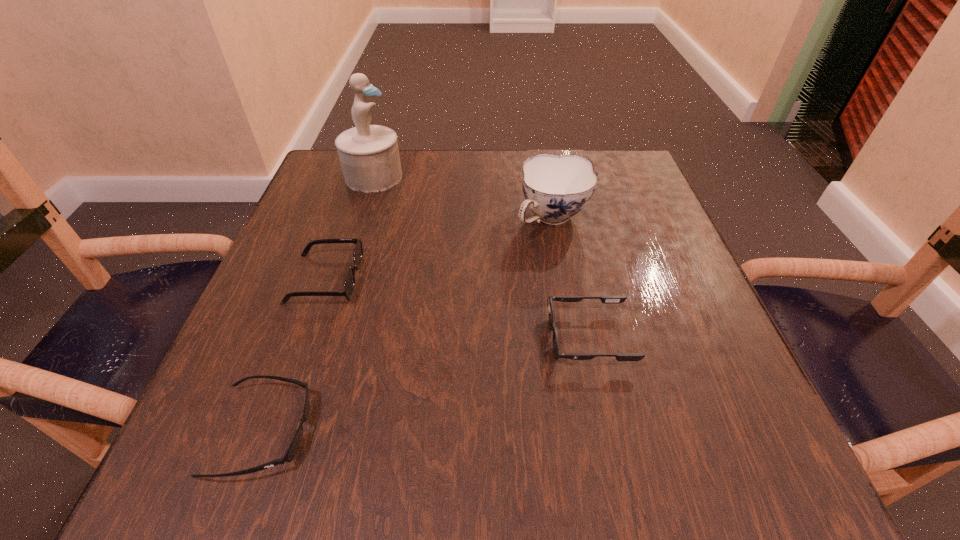
You are a GUI agent. You are given a task and a screenshot of the screen. Output one action in this format:
    pyautogui.click(x=<x>, y=<y>)
    Task: Click on the vacant area that lies between the fourth nearest object and the farthest object
    
    Given the screenshot: What is the action you would take?
    pyautogui.click(x=463, y=198)

Identify the location of free area in between the nearest object and the second nearest object. (426, 384).

Find the location of a particular element. object that is the second closest to the third nearest object is located at coordinates (369, 155).

What are the coordinates of `object identified as the third closest to the tallest object` in the screenshot? It's located at (604, 299).

Point out which sunglasses is positioned as the nearest to the chinaware. Please provide its 2D coordinates. Your answer should be formatted as a tuple, i.e. [(x, y)], where the tuple contains the x and y coordinates of a point satisfying the conditions above.

[(604, 299)]

Locate an element on the screen. The width and height of the screenshot is (960, 540). sunglasses that stands as the second closest to the nearest object is located at coordinates (604, 299).

What are the coordinates of `free space that satisfies the following two spatial constraints: 1. at the beak of the tallest object; 2. on the right side of the second farthest object` in the screenshot? It's located at (360, 219).

This screenshot has height=540, width=960. I want to click on vacant area that satisfies the following two spatial constraints: 1. at the beak of the tallest object; 2. on the right side of the second tallest object, so click(x=360, y=219).

Where is `blank space that satisfies the following two spatial constraints: 1. at the beak of the second tallest object; 2. on the right side of the figurine`? Image resolution: width=960 pixels, height=540 pixels. blank space that satisfies the following two spatial constraints: 1. at the beak of the second tallest object; 2. on the right side of the figurine is located at coordinates point(360,219).